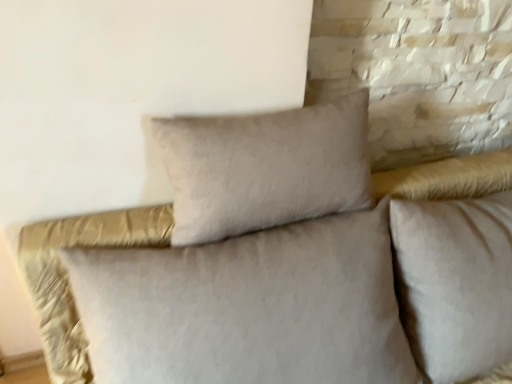
This screenshot has height=384, width=512. What do you see at coordinates (67, 277) in the screenshot?
I see `velvet beige bed at center` at bounding box center [67, 277].

This screenshot has width=512, height=384. I want to click on velvet beige bed at center, so click(67, 277).

This screenshot has height=384, width=512. Find the location of `velvet beige bed at center`. velvet beige bed at center is located at coordinates click(x=67, y=277).